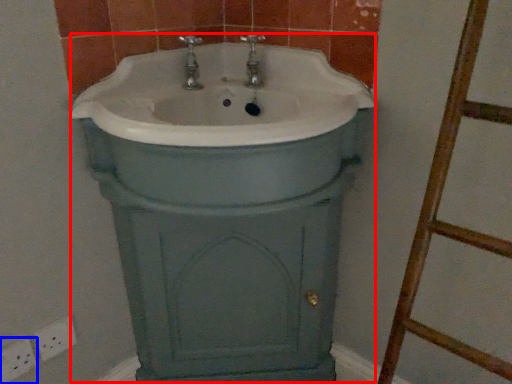
Question: Which object is further to the camera taking this photo, porcelain (highlighted by a red box) or electric outlet (highlighted by a blue box)?

Choices:
 (A) porcelain
 (B) electric outlet

Answer: (B)